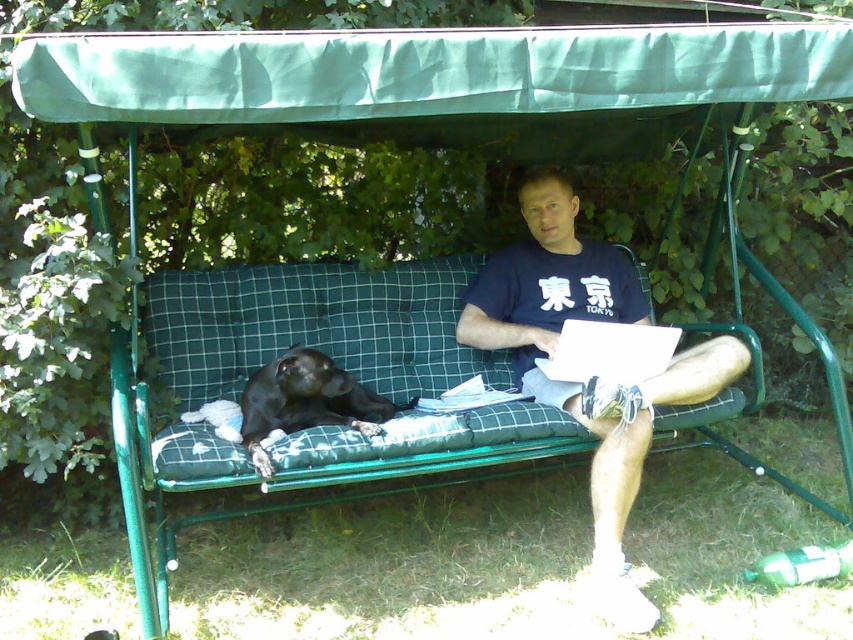
Question: Which of the following is the farthest from the observer?

Choices:
 (A) (554, 172)
 (B) (521, 38)
 (C) (308, 376)

Answer: (A)

Question: Is dark blue t-shirt at center positioned in front of black fur dog at left?

Choices:
 (A) no
 (B) yes

Answer: (B)

Question: Considering the relative positions of green fabric canopy at upper center and dark blue t-shirt at center in the image provided, where is green fabric canopy at upper center located with respect to dark blue t-shirt at center?

Choices:
 (A) left
 (B) right

Answer: (A)

Question: Which point appears farthest from the camera in this image?

Choices:
 (A) (758, 36)
 (B) (329, 392)
 (C) (625, 461)

Answer: (B)

Question: Estimate the real-world distances between objects in this image. Which object is closer to the dark blue t-shirt at center?

Choices:
 (A) black fur dog at left
 (B) green fabric canopy at upper center

Answer: (A)

Question: Does green fabric canopy at upper center have a greater width compared to black fur dog at left?

Choices:
 (A) no
 (B) yes

Answer: (B)